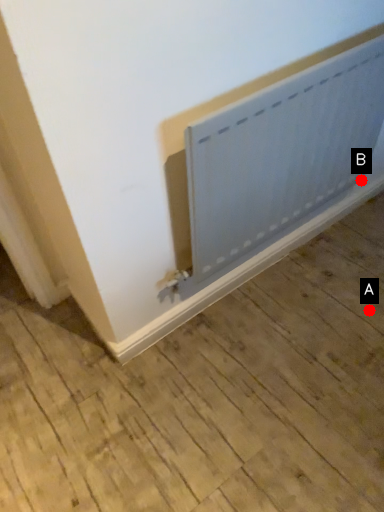
Question: Two points are circled on the image, labeled by A and B beside each circle. Among these points, which one is farthest from the camera?

Choices:
 (A) A is further
 (B) B is further

Answer: (B)